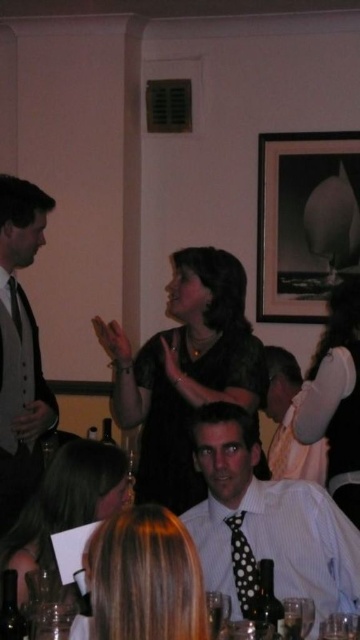
Which of these two, black satin dress at center or transparent glass at lower center, stands taller?

With more height is black satin dress at center.

From the picture: Between black satin dress at center and transparent glass at lower center, which one appears on the left side from the viewer's perspective?

black satin dress at center is more to the left.

In order to click on black satin dress at center in this screenshot , I will do `click(185, 371)`.

I want to click on black satin dress at center, so click(x=185, y=371).

Can you confirm if matte gray suit at left is shorter than smooth black dress at center?

No, matte gray suit at left is not shorter than smooth black dress at center.

Who is higher up, matte gray suit at left or smooth black dress at center?

matte gray suit at left is higher up.

What do you see at coordinates (20, 348) in the screenshot? This screenshot has height=640, width=360. I see `matte gray suit at left` at bounding box center [20, 348].

Locate an element on the screen. The height and width of the screenshot is (640, 360). matte gray suit at left is located at coordinates point(20,348).

Which of these two, smooth black dress at center or black dotted tie at center, stands taller?

smooth black dress at center

Is smooth black dress at center further to camera compared to black dotted tie at center?

No, smooth black dress at center is closer to the viewer.

Who is more distant from viewer, (109, 464) or (237, 595)?

Point (237, 595)

Locate an element on the screen. The image size is (360, 640). smooth black dress at center is located at coordinates (65, 502).